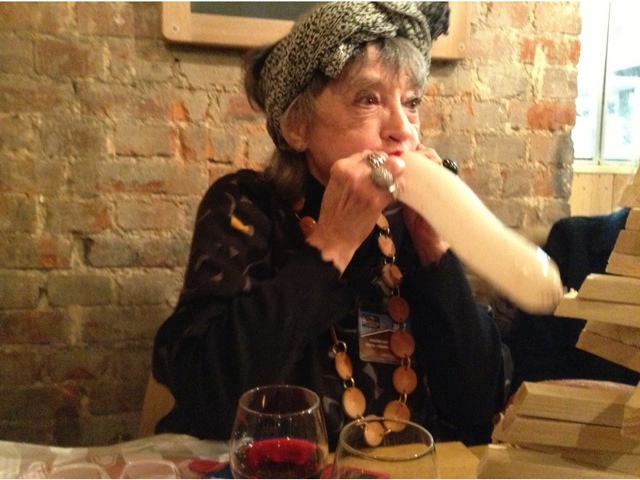
Locate an element on the screen. The image size is (640, 480). window is located at coordinates (616, 94).